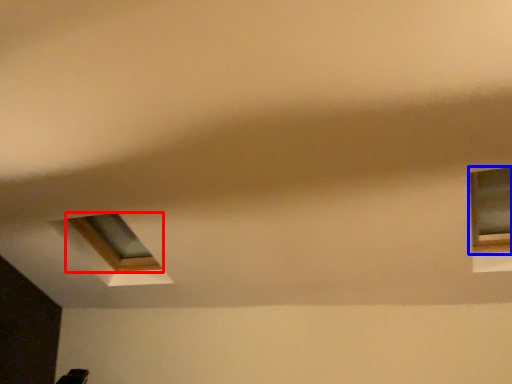
Question: Which object is further to the camera taking this photo, window (highlighted by a red box) or window (highlighted by a blue box)?

Choices:
 (A) window
 (B) window

Answer: (A)